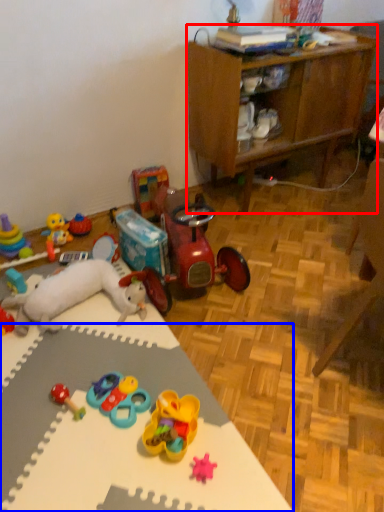
Question: Among these objects, which one is nearest to the camera, cabinetry (highlighted by a red box) or desk (highlighted by a blue box)?

Choices:
 (A) cabinetry
 (B) desk

Answer: (B)